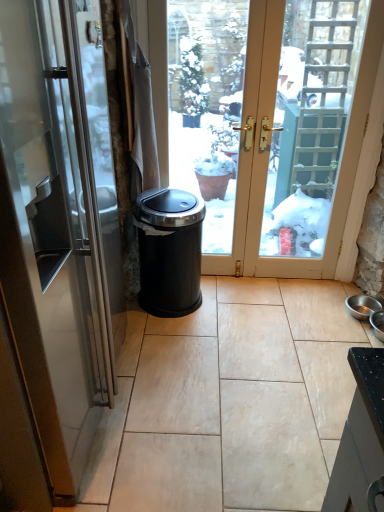
In order to face satin silver door at left, should I rotate leftwards or rightwards?

Turn left approximately 26.034 degrees to face it.

Where is `satin silver door at left`? Image resolution: width=384 pixels, height=512 pixels. satin silver door at left is located at coordinates (55, 226).

Describe the element at coordinates (55, 226) in the screenshot. I see `satin silver door at left` at that location.

Locate an element on the screen. The height and width of the screenshot is (512, 384). black plastic trash can at center is located at coordinates (169, 251).

What do you see at coordinates (169, 251) in the screenshot? I see `black plastic trash can at center` at bounding box center [169, 251].

I want to click on satin silver door at left, so click(x=55, y=226).

Is satin silver door at left to the right of black plastic trash can at center from the viewer's perspective?

No, satin silver door at left is not to the right of black plastic trash can at center.

Does satin silver door at left lie behind black plastic trash can at center?

No, it is in front of black plastic trash can at center.

Is point (8, 207) in front of point (155, 246)?

Yes, it is.

From the image's perspective, which object appears higher, satin silver door at left or black plastic trash can at center?

From the image's view, satin silver door at left is above.

From a real-world perspective, which object stands above the other?

satin silver door at left.

Which object is wider, satin silver door at left or black plastic trash can at center?

With larger width is satin silver door at left.

Who is shorter, satin silver door at left or black plastic trash can at center?

Standing shorter between the two is black plastic trash can at center.

Is satin silver door at left smaller than black plastic trash can at center?

No.

Is black plastic trash can at center located within satin silver door at left?

No, black plastic trash can at center is not a part of satin silver door at left.

Is satin silver door at left placed right next to black plastic trash can at center?

There is a gap between satin silver door at left and black plastic trash can at center.

Is satin silver door at left turned away from black plastic trash can at center?

No.

From the picture: How distant is satin silver door at left from black plastic trash can at center?

satin silver door at left and black plastic trash can at center are 29.22 inches apart from each other.

You are a GUI agent. You are given a task and a screenshot of the screen. Output one action in this format:
    pyautogui.click(x=<x>, y=<y>)
    Task: Click on the door on the left of black plastic trash can at center
    
    Given the screenshot: What is the action you would take?
    pyautogui.click(x=55, y=226)

Looking at this image, which object is positioned more to the left, black plastic trash can at center or satin silver door at left?

Positioned to the left is satin silver door at left.

In the image, is black plastic trash can at center positioned in front of or behind satin silver door at left?

black plastic trash can at center is positioned farther from the viewer than satin silver door at left.

Which is behind, point (157, 267) or point (18, 209)?

Positioned behind is point (157, 267).

From the image's perspective, is black plastic trash can at center under satin silver door at left?

Result: Yes.

From a real-world perspective, is black plastic trash can at center on satin silver door at left?

Actually, black plastic trash can at center is physically below satin silver door at left in the real world.

Considering the sizes of objects black plastic trash can at center and satin silver door at left in the image provided, who is thinner, black plastic trash can at center or satin silver door at left?

Answer: black plastic trash can at center is thinner.

Is black plastic trash can at center taller or shorter than satin silver door at left?

In the image, black plastic trash can at center appears to be shorter than satin silver door at left.

Does black plastic trash can at center have a smaller size compared to satin silver door at left?

Yes, black plastic trash can at center is smaller than satin silver door at left.

Is black plastic trash can at center surrounding satin silver door at left?

That's incorrect, satin silver door at left is not inside black plastic trash can at center.

Are black plastic trash can at center and satin silver door at left making contact?

No, black plastic trash can at center is not next to satin silver door at left.

Could you tell me if black plastic trash can at center is facing satin silver door at left?

No, black plastic trash can at center does not turn towards satin silver door at left.

What's the angular difference between black plastic trash can at center and satin silver door at left's facing directions?

The angle between the facing direction of black plastic trash can at center and the facing direction of satin silver door at left is 89.3 degrees.

This screenshot has width=384, height=512. In order to click on door that is above the black plastic trash can at center (from the image's perspective) in this screenshot , I will do `click(55, 226)`.

The image size is (384, 512). I want to click on waste container that appears behind the satin silver door at left, so coord(169,251).

Where is `waste container below the satin silver door at left (from the image's perspective)`? The image size is (384, 512). waste container below the satin silver door at left (from the image's perspective) is located at coordinates (169, 251).